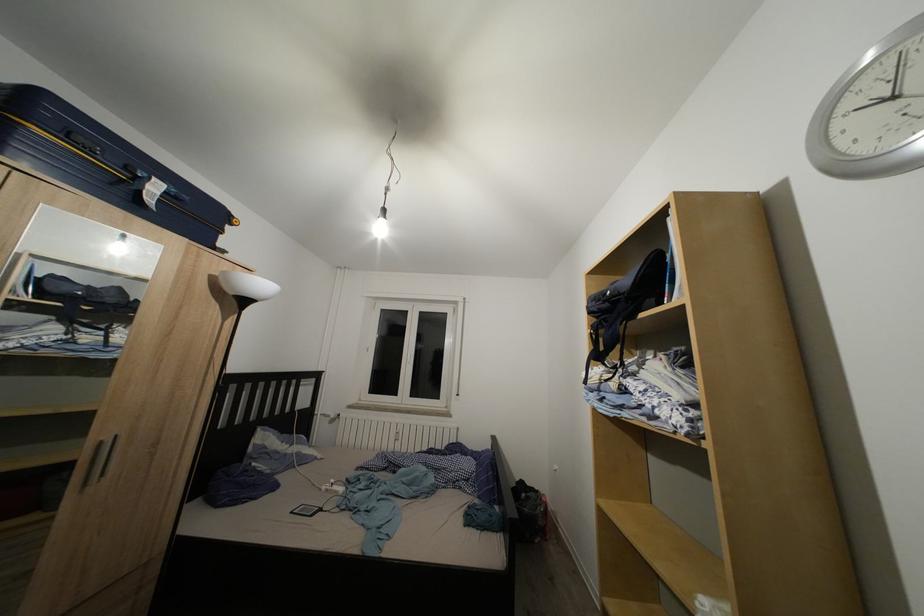
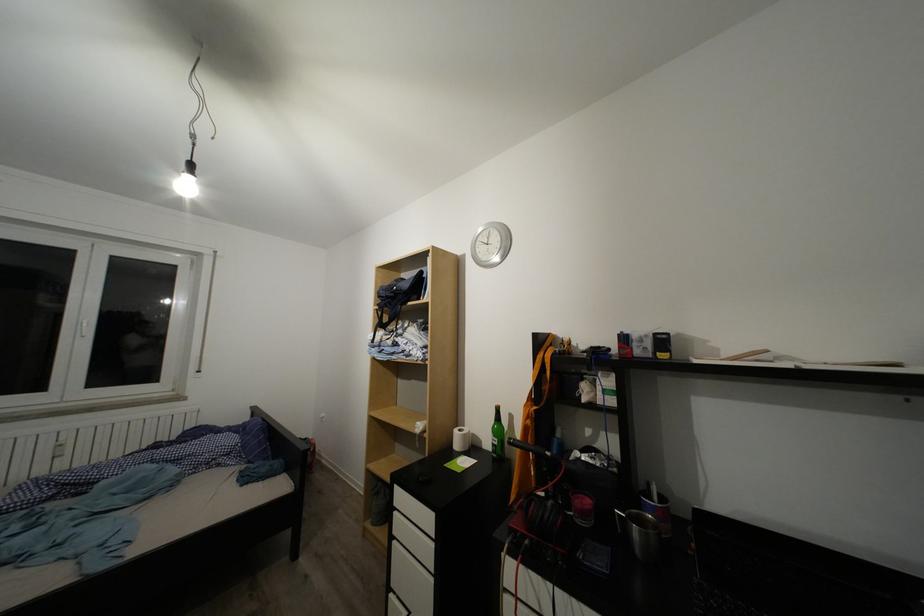
Locate, in the second image, the point that corresponds to point 387,236 in the first image.

(193, 195)